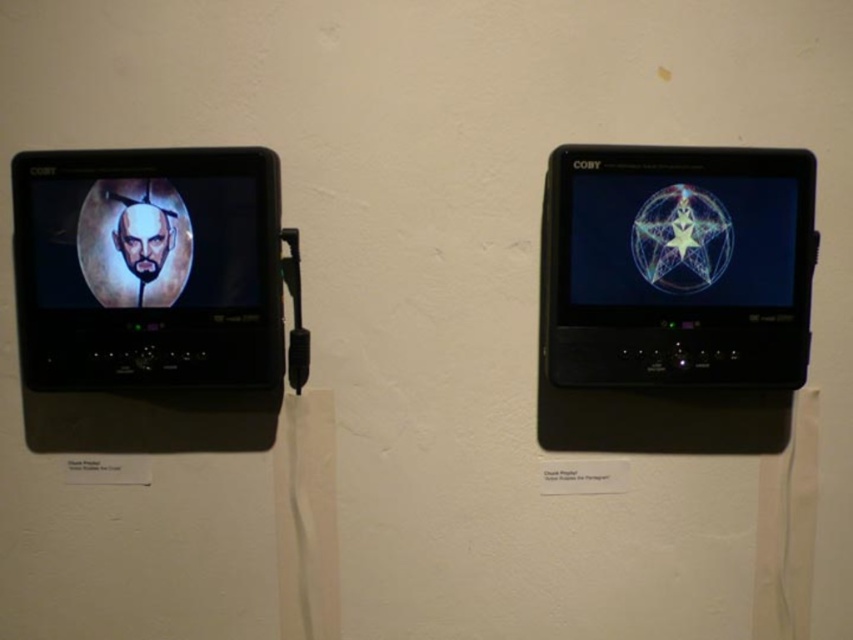
You are standing in front of two Coby monitors mounted on the wall. You notice two points marked on the wall below each monitor. The first point is labeled as point [781,205] and the second is point [44,305]. If you were to reach out to touch these points, which one would require you to extend your arm less?

Point [44,305] is closer to you than point [781,205] because it is less further to the camera. Therefore, touching point [44,305] would require less arm extension.

Based on the photo, you are an art student who wants to take a photo of both the matte black portrait at left and the matte black smartphone at right. Since both have matte black frames, you are concerned about them blending into the background. Which object should you move closer to the camera to make it stand out more?

The matte black smartphone at right is in front of the matte black portrait at left, so moving the matte black smartphone at right closer to the camera will make it stand out more against the background.

You are an art curator planning to move the matte black smartphone at right and the matte black portrait at left to a new exhibition space. The new space has limited vertical space. Which object should you move first to ensure both fit vertically?

The matte black smartphone at right is positioned under the matte black portrait at left. To fit both vertically in the new space with limited vertical space, move the matte black smartphone at right first so that it can be placed above the portrait, utilizing the space more efficiently.